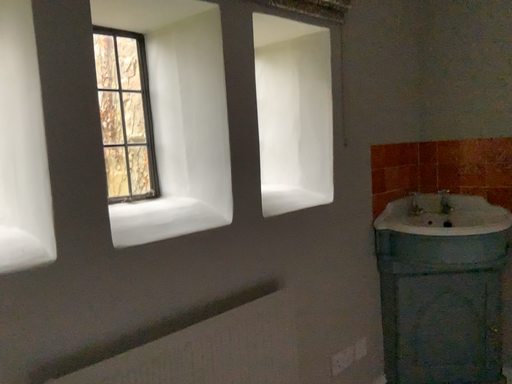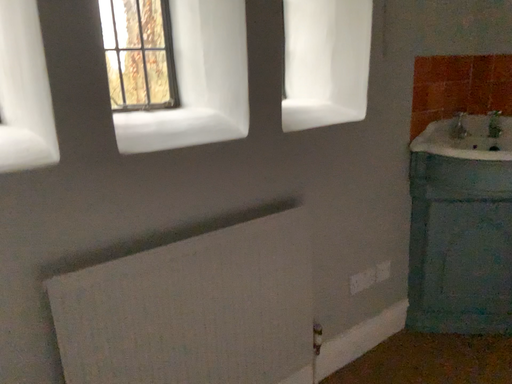
Question: How did the camera likely rotate when shooting the video?

Choices:
 (A) rotated downward
 (B) rotated upward

Answer: (A)